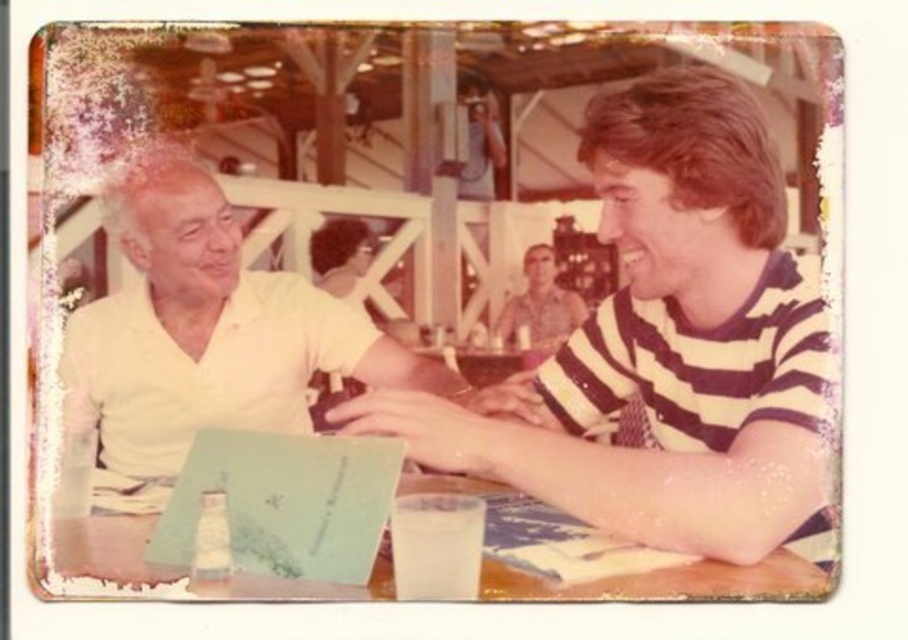
Question: Is white matte shirt at left below wooden table at lower left?

Choices:
 (A) yes
 (B) no

Answer: (B)

Question: Which point is farther from the camera taking this photo?

Choices:
 (A) (387, 570)
 (B) (543, 266)
 (C) (617, 312)
 (D) (63, 400)

Answer: (C)

Question: Estimate the real-world distances between objects in this image. Which object is farther from the white matte shirt at left?

Choices:
 (A) white matte shirt at upper left
 (B) wooden table at lower left
 (C) striped cotton shirt at center

Answer: (C)

Question: Is white matte shirt at left below striped cotton shirt at center?

Choices:
 (A) yes
 (B) no

Answer: (A)

Question: Is white matte shirt at upper left above white matte shirt at left?

Choices:
 (A) yes
 (B) no

Answer: (A)

Question: Estimate the real-world distances between objects in this image. Which object is farther from the white matte shirt at upper left?

Choices:
 (A) striped cotton shirt at center
 (B) white matte shirt at left

Answer: (A)